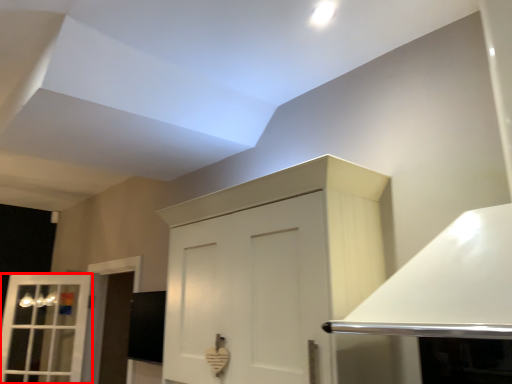
Question: From the image's perspective, where is window (annotated by the red box) located relative to cabinetry?

Choices:
 (A) below
 (B) above

Answer: (A)